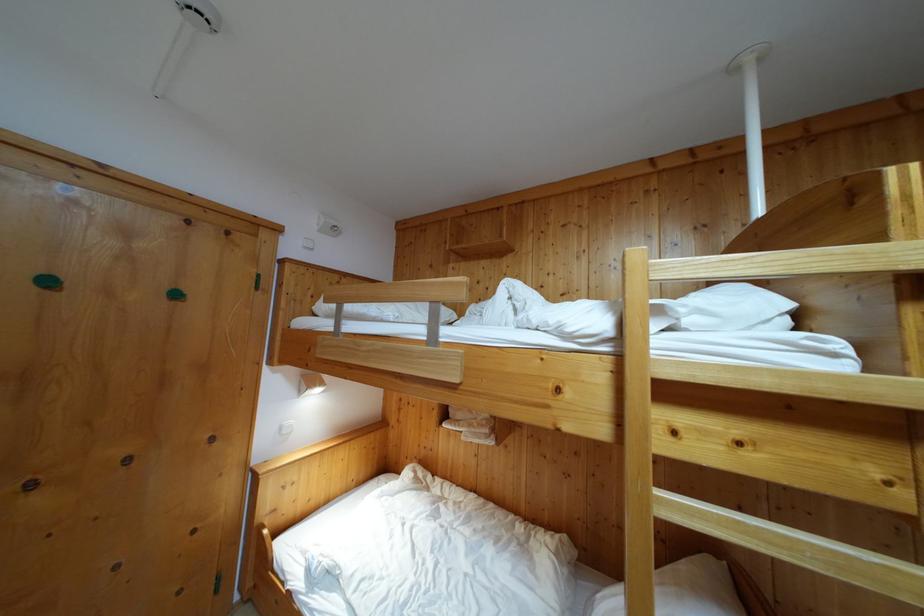
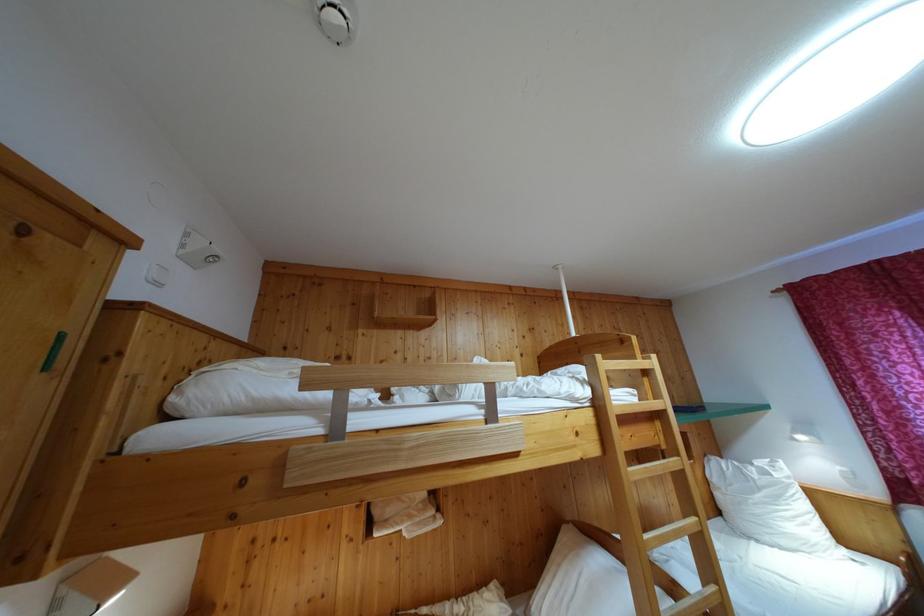
Where in the second image is the point corresponding to point 318,314 from the first image?

(176, 406)